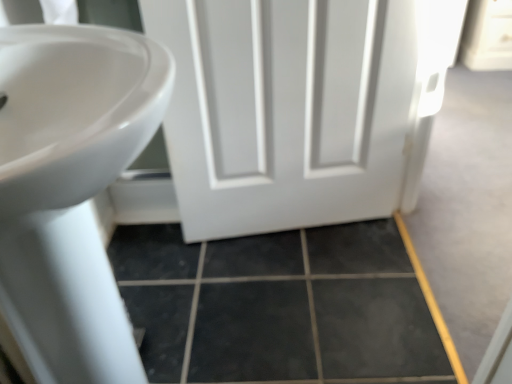
Identify the location of vacant area situated below white matte door at center (from a real-world perspective). (290, 229).